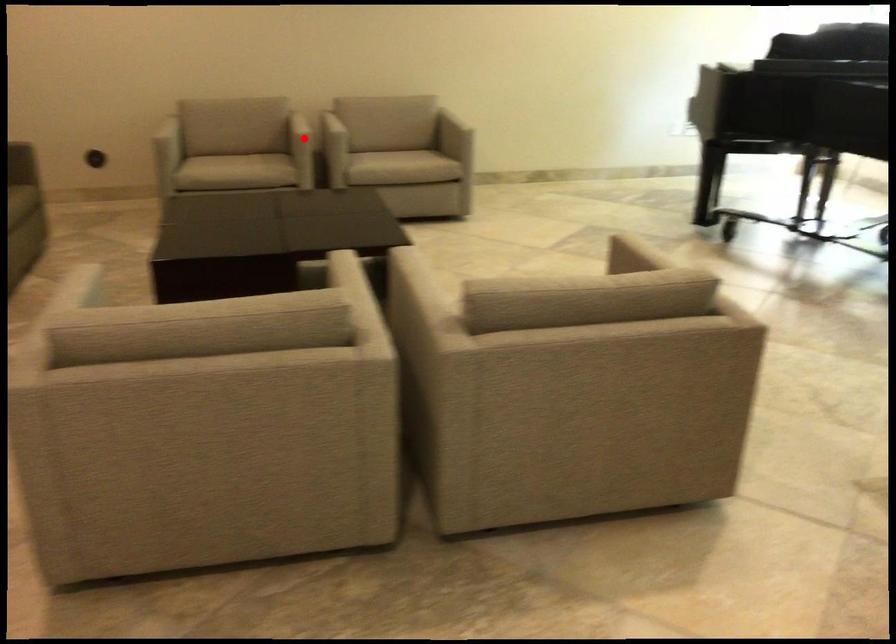
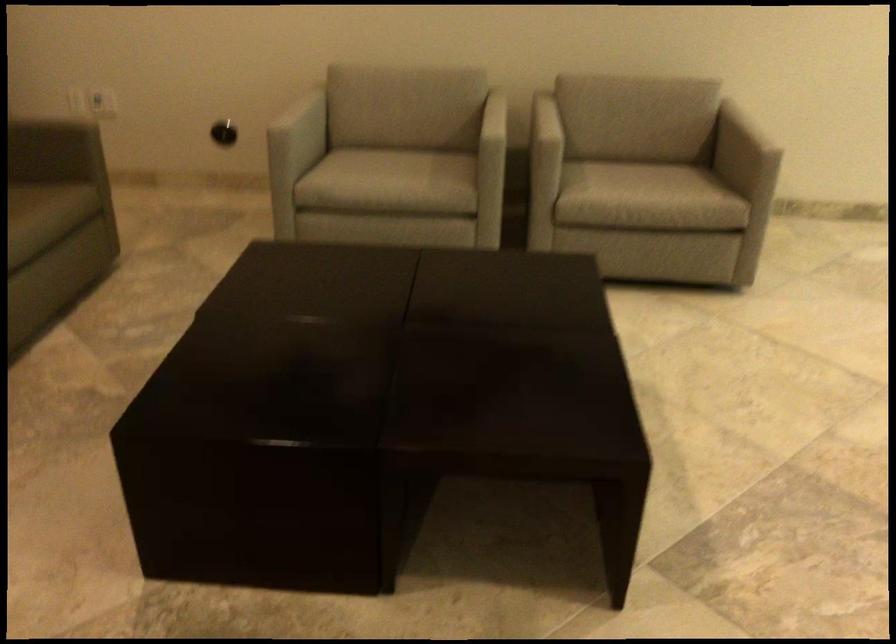
Question: I am providing you with two images of the same scene from different viewpoints. In image1, a red point is highlighted. Considering the same 3D point in image2, which of the following is correct?

Choices:
 (A) It is closer
 (B) It is farther

Answer: (A)